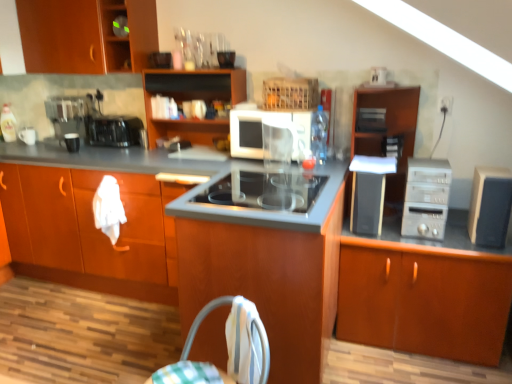
This screenshot has width=512, height=384. In order to click on free location in front of black plastic speaker at right, the third appliance when ordered from left to right in this screenshot , I will do `click(373, 239)`.